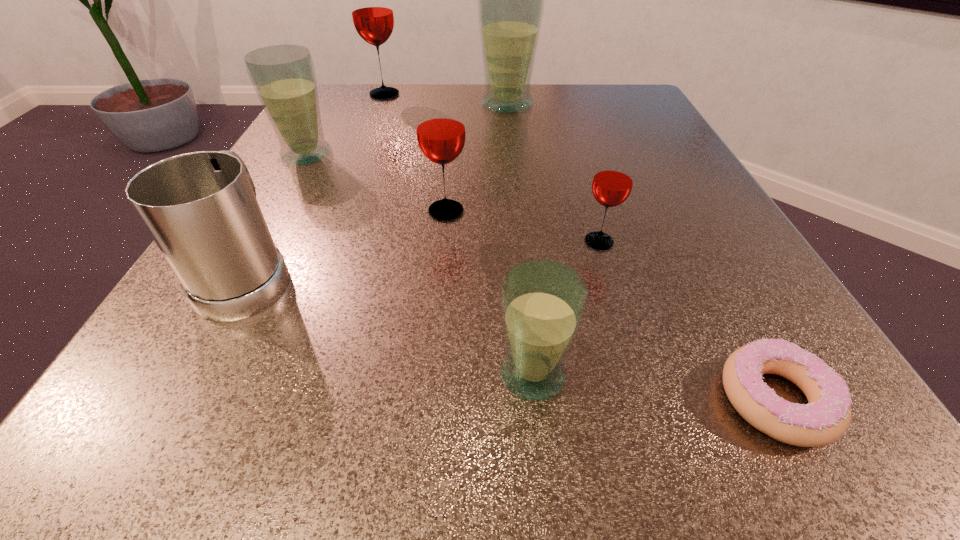
You are a GUI agent. You are given a task and a screenshot of the screen. Output one action in this format:
    pyautogui.click(x=<x>, y=<y>)
    Task: Click on the nearest glass
    
    Given the screenshot: What is the action you would take?
    pyautogui.click(x=543, y=302)

You are a GUI agent. You are given a task and a screenshot of the screen. Output one action in this format:
    pyautogui.click(x=<x>, y=<y>)
    Task: Click on the smallest blue glass
    The image size is (960, 540).
    Given the screenshot: What is the action you would take?
    pyautogui.click(x=543, y=302)

You are a GUI agent. You are given a task and a screenshot of the screen. Output one action in this format:
    pyautogui.click(x=<x>, y=<y>)
    Task: Click on the doughnut
    This screenshot has height=540, width=960.
    Given the screenshot: What is the action you would take?
    pyautogui.click(x=826, y=417)

Identify the location of the shortest object. (826, 417).

Where is `vacant space located on the right of the second glass from left to right`? Image resolution: width=960 pixels, height=540 pixels. vacant space located on the right of the second glass from left to right is located at coordinates (x=445, y=94).

You are a GUI agent. You are given a task and a screenshot of the screen. Output one action in this format:
    pyautogui.click(x=<x>, y=<y>)
    Task: Click on the vacant point located 0.300m on the left of the biggest blue glass
    This screenshot has height=540, width=960.
    Given the screenshot: What is the action you would take?
    pyautogui.click(x=346, y=104)

Where is `free space located on the right of the sixth nearest object`? Image resolution: width=960 pixels, height=540 pixels. free space located on the right of the sixth nearest object is located at coordinates (366, 155).

Where is `blank space located on the back of the fourth object from left to right`? Image resolution: width=960 pixels, height=540 pixels. blank space located on the back of the fourth object from left to right is located at coordinates (454, 128).

Where is `free space located 0.210m on the side of the gray mug with the handle`? The image size is (960, 540). free space located 0.210m on the side of the gray mug with the handle is located at coordinates [310, 163].

This screenshot has width=960, height=540. In order to click on free space located 0.290m on the side of the gray mug with the handle in this screenshot , I will do `click(322, 142)`.